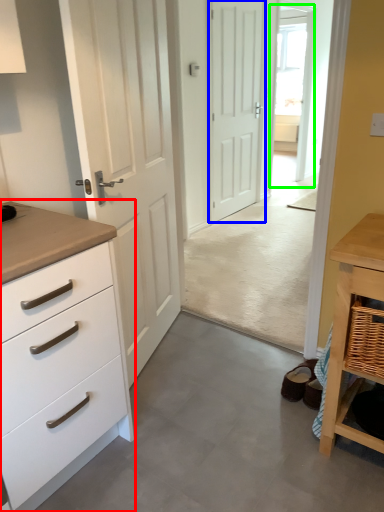
Question: Which is farther away from chest of drawers (highlighted by a red box)? door (highlighted by a blue box) or glass door (highlighted by a green box)?

Choices:
 (A) door
 (B) glass door

Answer: (B)